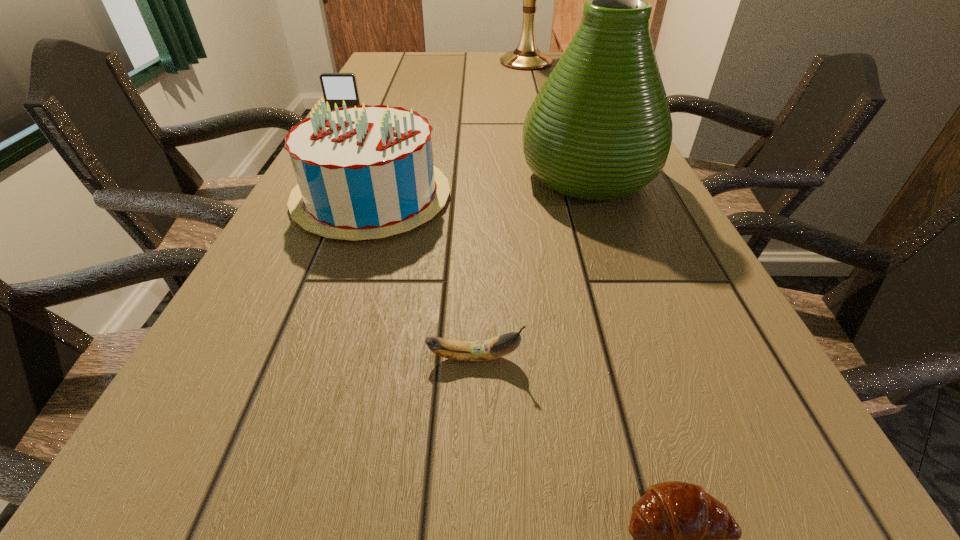
This screenshot has height=540, width=960. I want to click on vacant area at the left edge of the desktop, so click(401, 75).

Image resolution: width=960 pixels, height=540 pixels. I want to click on free space at the right edge, so click(605, 249).

Where is `free region at the far left corner of the desktop`? The image size is (960, 540). free region at the far left corner of the desktop is located at coordinates 410,68.

Identify the location of unoccupied position between the fourth shortest object and the second tallest object. (480, 186).

Where is `free space between the tallest object and the fifth tallest object`? free space between the tallest object and the fifth tallest object is located at coordinates (500, 210).

Locate an element on the screen. Image resolution: width=960 pixels, height=540 pixels. free area in between the second tallest object and the fourth shortest object is located at coordinates (480, 186).

Image resolution: width=960 pixels, height=540 pixels. I want to click on free space between the birthday cake and the fifth shortest object, so click(480, 186).

You are a GUI agent. You are given a task and a screenshot of the screen. Output one action in this format:
    pyautogui.click(x=<x>, y=<y>)
    Task: Click on the free space between the birthday cake and the tallest object
    The image size is (960, 540).
    Given the screenshot: What is the action you would take?
    pyautogui.click(x=449, y=129)

You are a GUI agent. You are given a task and a screenshot of the screen. Output one action in this format:
    pyautogui.click(x=<x>, y=<y>)
    Task: Click on the third closest object relative to the vase
    
    Given the screenshot: What is the action you would take?
    pyautogui.click(x=336, y=87)

Locate an element on the screen. object that ranks as the third closest to the fourth tallest object is located at coordinates (526, 56).